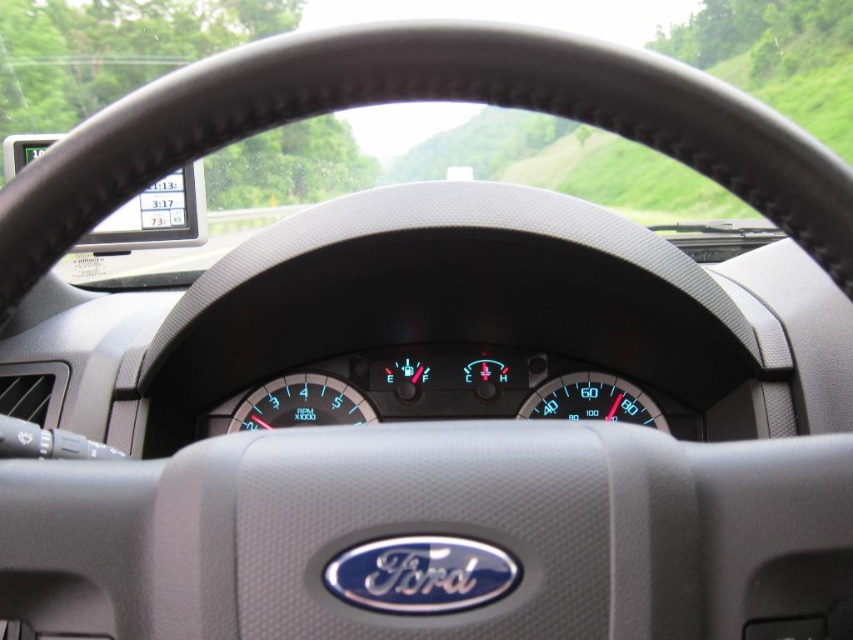
Question: Estimate the real-world distances between objects in this image. Which object is farther from the blue glossy speedometer at center?

Choices:
 (A) blue digital display at center
 (B) transparent glass windshield at upper center

Answer: (B)

Question: Is transparent glass windshield at upper center to the right of blue glossy speedometer at center from the viewer's perspective?

Choices:
 (A) no
 (B) yes

Answer: (A)

Question: Which of these objects is positioned farthest from the blue glossy speedometer at center?

Choices:
 (A) blue digital display at center
 (B) transparent glass windshield at upper center

Answer: (B)

Question: Is transparent glass windshield at upper center above blue digital display at center?

Choices:
 (A) no
 (B) yes

Answer: (B)

Question: Is blue digital display at center thinner than blue glossy speedometer at center?

Choices:
 (A) no
 (B) yes

Answer: (A)

Question: Which of the following is the farthest from the observer?

Choices:
 (A) (624, 400)
 (B) (315, 376)

Answer: (B)